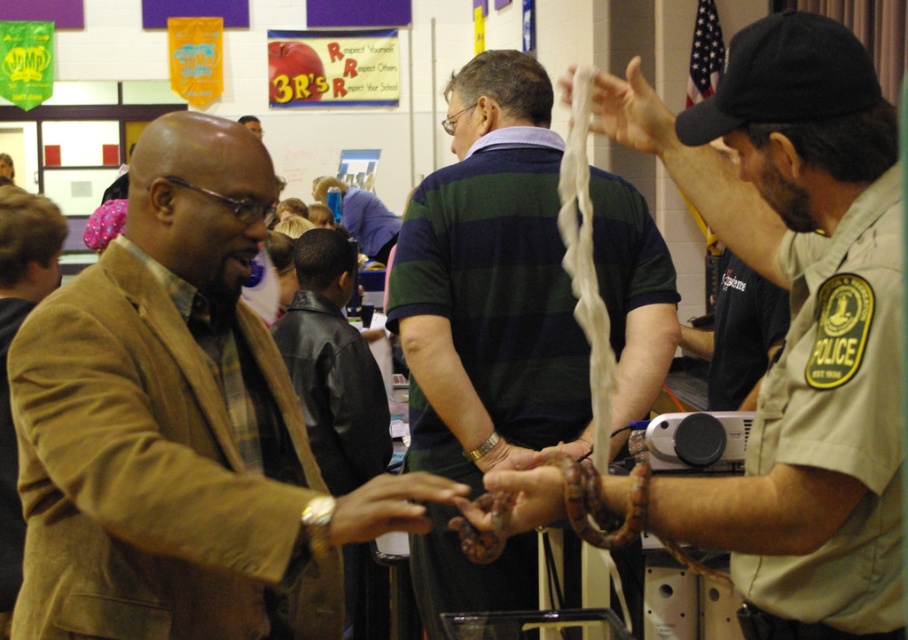
Question: Can you confirm if brown leather jacket at left is positioned below smooth brown snake at center?

Choices:
 (A) yes
 (B) no

Answer: (A)

Question: Which point is farther to the camera?

Choices:
 (A) silver metallic bracelet at center
 (B) brown woolen jacket at left

Answer: (A)

Question: Which of the following is the closest to the observer?

Choices:
 (A) (670, 161)
 (B) (174, 150)
 (C) (42, 196)

Answer: (B)

Question: Can you confirm if green striped shirt at center is smaller than brown woolen jacket at left?

Choices:
 (A) yes
 (B) no

Answer: (B)

Question: Which of the following is the closest to the observer?

Choices:
 (A) (467, 125)
 (B) (479, 445)

Answer: (B)

Question: Does brown leather jacket at left appear under silver metallic bracelet at center?

Choices:
 (A) yes
 (B) no

Answer: (B)